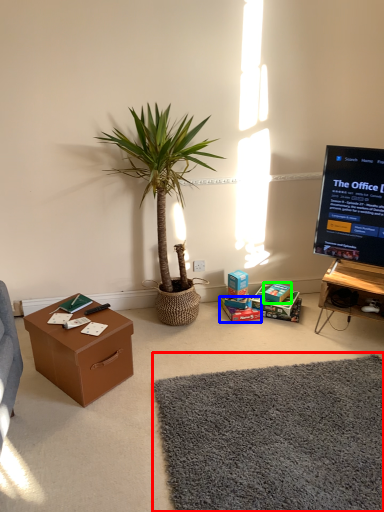
Question: Which object is the closest to the plain (highlighted by a red box)? Choose among these: storage box (highlighted by a blue box) or storage box (highlighted by a green box).

Choices:
 (A) storage box
 (B) storage box

Answer: (A)